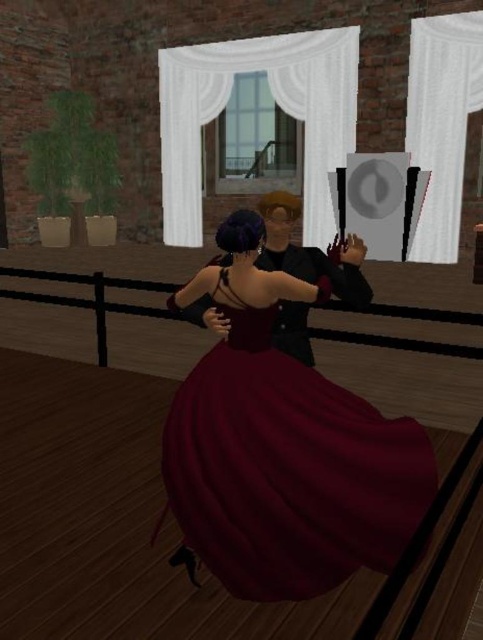
In the scene shown: Is burgundy satin dress at center thinner than shiny black suit at center?

→ No.

Can you confirm if burgundy satin dress at center is positioned to the left of shiny black suit at center?

Correct, you'll find burgundy satin dress at center to the left of shiny black suit at center.

The height and width of the screenshot is (640, 483). In order to click on burgundy satin dress at center in this screenshot , I will do `click(286, 467)`.